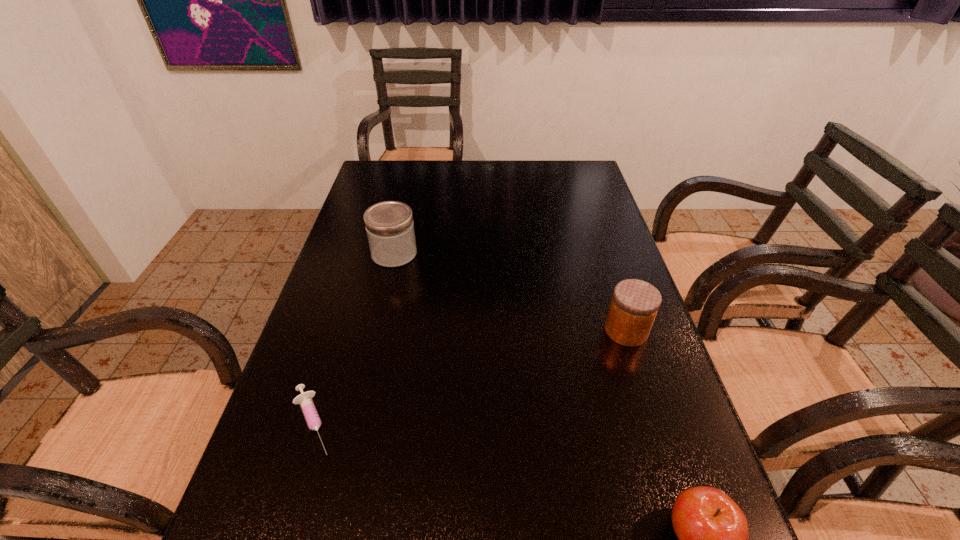
The width and height of the screenshot is (960, 540). In order to click on the farthest object in this screenshot , I will do `click(389, 225)`.

At what (x,y) coordinates should I click in order to perform the action: click on the left jar. Please return your answer as a coordinate pair (x, y). Looking at the image, I should click on (389, 225).

Identify the location of the right jar. (635, 303).

Image resolution: width=960 pixels, height=540 pixels. Find the location of `the nearer jar`. the nearer jar is located at coordinates (635, 303).

In order to click on syringe in this screenshot , I will do `click(308, 408)`.

Where is `the second nearest object`? Image resolution: width=960 pixels, height=540 pixels. the second nearest object is located at coordinates (308, 408).

Where is `vacant space located 0.210m on the back of the farther jar`? The width and height of the screenshot is (960, 540). vacant space located 0.210m on the back of the farther jar is located at coordinates (406, 202).

I want to click on blank space located on the back of the second farthest object, so click(613, 293).

In order to click on free space located on the front of the syringe in this screenshot , I will do `click(280, 529)`.

Image resolution: width=960 pixels, height=540 pixels. What are the coordinates of `jar present at the left edge` in the screenshot? It's located at (389, 225).